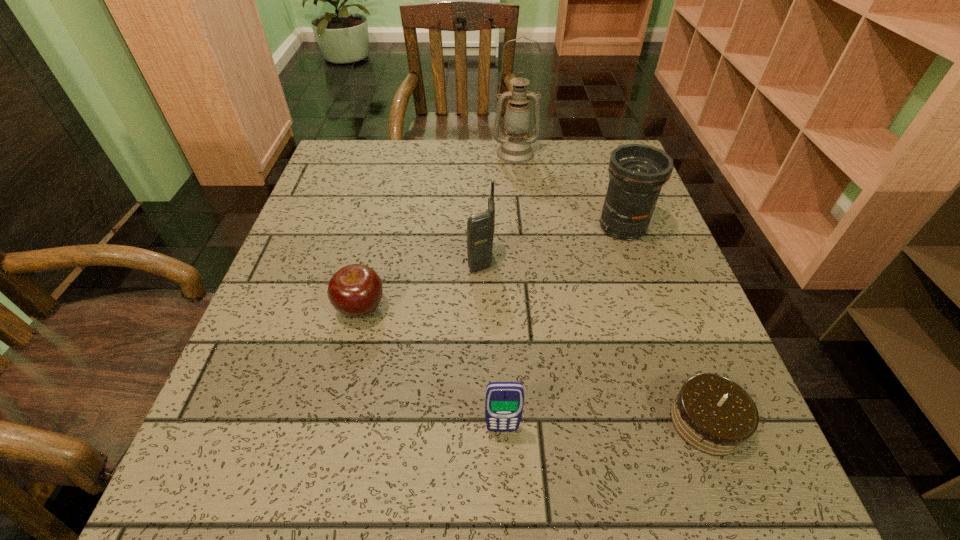
Image resolution: width=960 pixels, height=540 pixels. I want to click on free space between the shorter cellular telephone and the chocolate cake, so click(x=605, y=426).

Locate an element on the screen. This screenshot has height=540, width=960. free space between the taller cellular telephone and the nearer cellular telephone is located at coordinates (492, 345).

Locate an element on the screen. free space between the fourth nearest object and the shortest object is located at coordinates (594, 341).

The image size is (960, 540). Identify the location of free space between the oil lamp and the farther cellular telephone. (498, 207).

Find the location of a particular element. The width and height of the screenshot is (960, 540). empty space that is in between the tallest object and the fourth tallest object is located at coordinates coord(509,291).

At what (x,y) coordinates should I click in order to perform the action: click on free spot between the fourth farthest object and the shortest object. Please return your answer as a coordinate pair (x, y). Looking at the image, I should click on (534, 365).

Locate an element on the screen. The image size is (960, 540). free space between the second shortest object and the farthest object is located at coordinates (438, 231).

Point out which object is positioned as the third nearest to the telephoto lens. Please provide its 2D coordinates. Your answer should be formatted as a tuple, i.e. [(x, y)], where the tuple contains the x and y coordinates of a point satisfying the conditions above.

[(714, 415)]

Locate an element on the screen. This screenshot has width=960, height=540. object that can be found as the second closest to the tallest object is located at coordinates (480, 227).

This screenshot has width=960, height=540. I want to click on free space that satisfies the following two spatial constraints: 1. on the keyboard of the fourth nearest object; 2. on the back side of the shortest object, so click(482, 422).